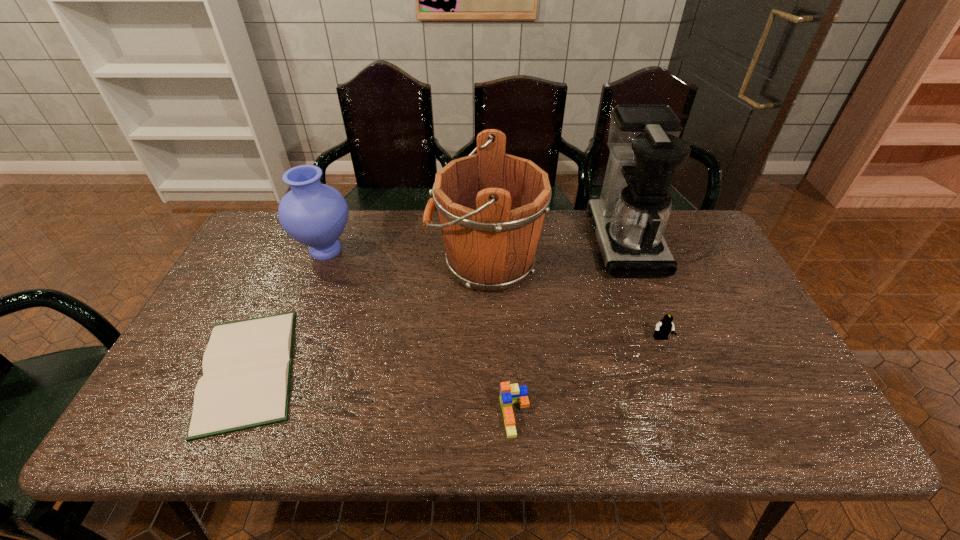
You are a GUI agent. You are given a task and a screenshot of the screen. Output one action in this format:
    pyautogui.click(x=<x>, y=<y>)
    Task: Click on the coffee maker
    The image size is (960, 540).
    Given the screenshot: What is the action you would take?
    pyautogui.click(x=629, y=219)

This screenshot has height=540, width=960. I want to click on bucket, so click(491, 205).

Where is `vase`? Image resolution: width=960 pixels, height=540 pixels. vase is located at coordinates (314, 214).

At what (x,y) coordinates should I click in order to perform the action: click on the third shortest object. Please return your answer as a coordinate pair (x, y). Looking at the image, I should click on (665, 326).

At what (x,y) coordinates should I click in order to perform the action: click on the taller Lego. Please return your answer as a coordinate pair (x, y). This screenshot has width=960, height=540. Looking at the image, I should click on (665, 326).

Locate an element on the screen. This screenshot has height=540, width=960. the nearer Lego is located at coordinates (509, 393).

You are a GUI agent. You are given a task and a screenshot of the screen. Output one action in this format:
    pyautogui.click(x=<x>, y=<y>)
    Task: Click on the left Lego
    The width and height of the screenshot is (960, 540).
    Given the screenshot: What is the action you would take?
    pyautogui.click(x=509, y=393)

At what (x,y) coordinates should I click in order to perform the action: click on the shortest object. Please return your answer as a coordinate pair (x, y). The height and width of the screenshot is (540, 960). Looking at the image, I should click on (245, 383).

You are a GUI agent. You are given a task and a screenshot of the screen. Output one action in this format:
    pyautogui.click(x=<x>, y=<y>)
    Task: Click on the vacant region located 0.240m at the front of the coffee maker where the controls are located
    
    Given the screenshot: What is the action you would take?
    pyautogui.click(x=517, y=241)

The image size is (960, 540). I want to click on vacant space located at the front of the coffee maker where the controls are located, so click(x=548, y=241).